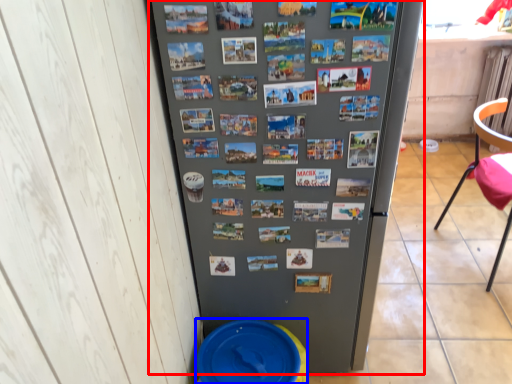
Question: Among these objects, which one is nearest to the camera, refrigerator (highlighted by a red box) or potty (highlighted by a blue box)?

Choices:
 (A) refrigerator
 (B) potty

Answer: (A)